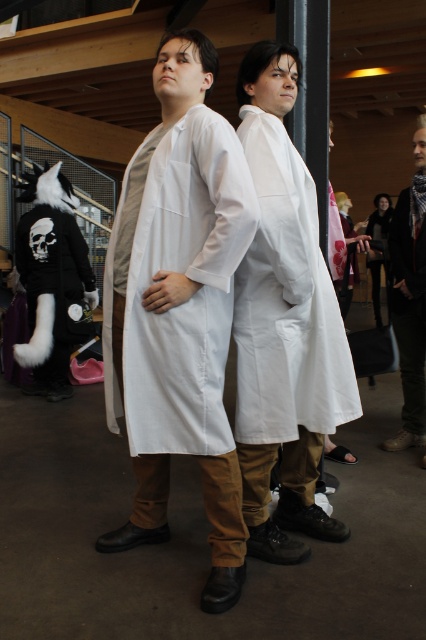
You are at the convention and want to move from point A to point B. Point A is at coordinates point (160, 404) and point B is at coordinates point (305, 198). Which point is closer to you?

Point (160, 404) is in front of point (305, 198), so point (160, 404) is closer to you.

From the picture: You are organizing a costume party and need to ensure that all guests can fit through a narrow hallway. The hallway is just wide enough to accommodate the dark brown leather jacket at right. Will the white matte lab coat at center fit through the same hallway?

The white matte lab coat at center is wider than the dark brown leather jacket at right. Since the hallway is only wide enough for the jacket, the lab coat may not fit through the hallway.

You are at a convention and see two people in lab coats. One has their hands clasped, and the other has one hand in their pocket. There is also someone with a black outfit and a tail. Can you tell me what the point at coordinates (178, 308) represents?

The point at coordinates (178, 308) corresponds to the white cotton lab coat at center.